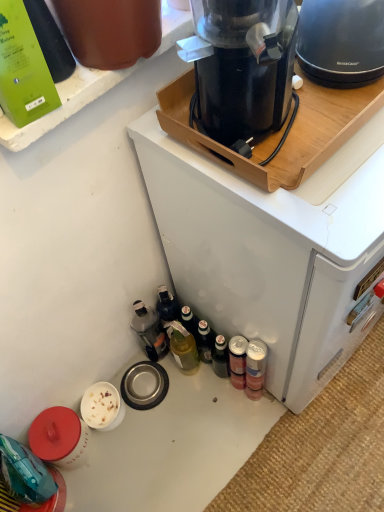
Question: Is matte black kettle at upper right, which is the 1th kitchen appliance from right to left, looking in the opposite direction of black plastic coffee maker at upper center?

Choices:
 (A) no
 (B) yes

Answer: (A)

Question: From the image's perspective, is matte black kettle at upper right, which is the 1th kitchen appliance from right to left, located beneath black plastic coffee maker at upper center?

Choices:
 (A) no
 (B) yes

Answer: (A)

Question: From a real-world perspective, is matte black kettle at upper right, which appears as the 2th kitchen appliance when viewed from the left, over black plastic coffee maker at upper center?

Choices:
 (A) yes
 (B) no

Answer: (A)

Question: Would you say black plastic coffee maker at upper center is part of matte black kettle at upper right, which is the 1th kitchen appliance from right to left,'s contents?

Choices:
 (A) no
 (B) yes

Answer: (A)

Question: Considering the relative positions of matte black kettle at upper right, which appears as the 2th kitchen appliance when viewed from the left, and black plastic coffee maker at upper center in the image provided, is matte black kettle at upper right, which appears as the 2th kitchen appliance when viewed from the left, to the right of black plastic coffee maker at upper center from the viewer's perspective?

Choices:
 (A) yes
 (B) no

Answer: (A)

Question: Considering the relative positions of green matte bottle at upper left, the 3th bottle positioned from the right, and black plastic coffee maker at upper center, which appears as the second kitchen appliance when viewed from the right, in the image provided, is green matte bottle at upper left, the 3th bottle positioned from the right, to the left or to the right of black plastic coffee maker at upper center, which appears as the second kitchen appliance when viewed from the right,?

Choices:
 (A) right
 (B) left

Answer: (B)

Question: Is green matte bottle at upper left, which is counted as the third bottle, starting from the back, spatially inside black plastic coffee maker at upper center, which appears as the second kitchen appliance when viewed from the right, or outside of it?

Choices:
 (A) outside
 (B) inside

Answer: (A)

Question: From the image's perspective, is green matte bottle at upper left, marked as the third bottle in a bottom-to-top arrangement, above or below black plastic coffee maker at upper center, which is the first kitchen appliance from left to right?

Choices:
 (A) above
 (B) below

Answer: (A)

Question: In terms of height, does green matte bottle at upper left, which is counted as the third bottle, starting from the back, look taller or shorter compared to black plastic coffee maker at upper center, which appears as the second kitchen appliance when viewed from the right?

Choices:
 (A) short
 (B) tall

Answer: (A)

Question: In terms of height, does metallic silver can at lower right, marked as the second bottle in a front-to-back arrangement, look taller or shorter compared to translucent plastic bottle at lower left, arranged as the second bottle when ordered from the bottom?

Choices:
 (A) tall
 (B) short

Answer: (A)

Question: From the image's perspective, is metallic silver can at lower right, which is the 3th bottle in left-to-right order, above or below translucent plastic bottle at lower left, which is the third bottle in front-to-back order?

Choices:
 (A) above
 (B) below

Answer: (B)

Question: Relative to translucent plastic bottle at lower left, which is counted as the 2th bottle, starting from the left, is metallic silver can at lower right, which appears as the third bottle when viewed from the top, in front or behind?

Choices:
 (A) front
 (B) behind

Answer: (A)

Question: Based on their sizes in the image, would you say metallic silver can at lower right, which appears as the 1th bottle when ordered from the bottom, is bigger or smaller than translucent plastic bottle at lower left, which is counted as the 2th bottle, starting from the left?

Choices:
 (A) small
 (B) big

Answer: (A)

Question: Is green matte bottle at upper left, the 3th bottle positioned from the right, inside the boundaries of metallic silver can at lower right, marked as the second bottle in a front-to-back arrangement, or outside?

Choices:
 (A) outside
 (B) inside

Answer: (A)

Question: From their relative heights in the image, would you say green matte bottle at upper left, which appears as the first bottle when viewed from the front, is taller or shorter than metallic silver can at lower right, which appears as the third bottle when viewed from the top?

Choices:
 (A) short
 (B) tall

Answer: (A)